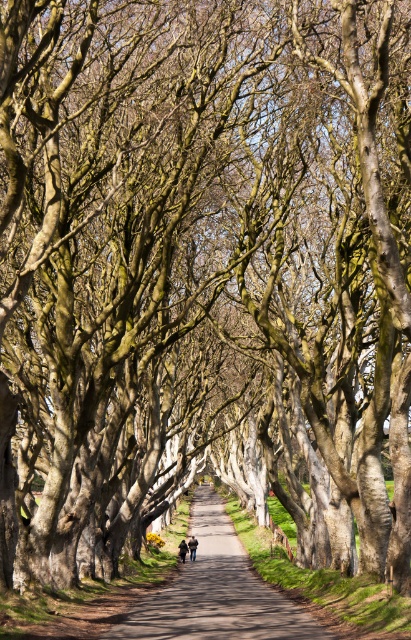
You are standing on the path in the tree tunnel and see two points marked on the ground ahead of you. The first point is at coordinates point (x=228, y=563) and the second is at point (x=182, y=560). Which point is closer to you?

Point (x=228, y=563) is closer to you because it is further to the viewer than point (x=182, y=560).

You are standing on the smooth asphalt path at center and see the dark brown leather jacket at center. Where is the jacket located relative to the path?

The dark brown leather jacket at center is above the smooth asphalt path at center.